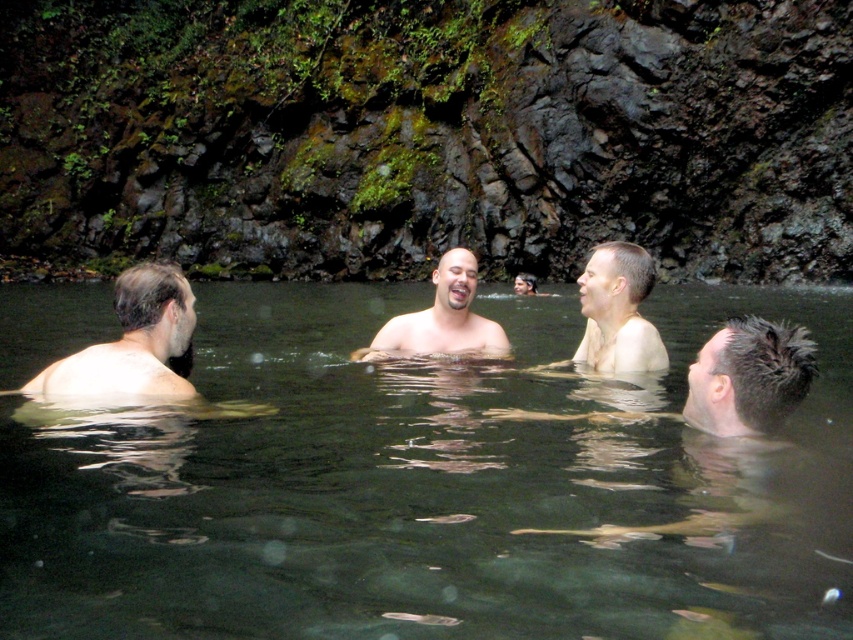
Question: Which is nearer to the smooth skin man at center?

Choices:
 (A) light brown skin at center
 (B) transparent water at center
 (C) light brown skin at left

Answer: (A)

Question: Among these objects, which one is farthest from the camera?

Choices:
 (A) light brown skin at center
 (B) light brown skin at left

Answer: (A)

Question: Is light brown skin at left thinner than light brown skin at center?

Choices:
 (A) yes
 (B) no

Answer: (B)

Question: Among these objects, which one is nearest to the camera?

Choices:
 (A) light brown skin at left
 (B) transparent water at center
 (C) smooth skin man at center

Answer: (B)

Question: Is transparent water at center closer to the viewer compared to light brown skin at center?

Choices:
 (A) no
 (B) yes

Answer: (B)

Question: Is light brown skin at center to the right of smooth skin man at center from the viewer's perspective?

Choices:
 (A) no
 (B) yes

Answer: (B)